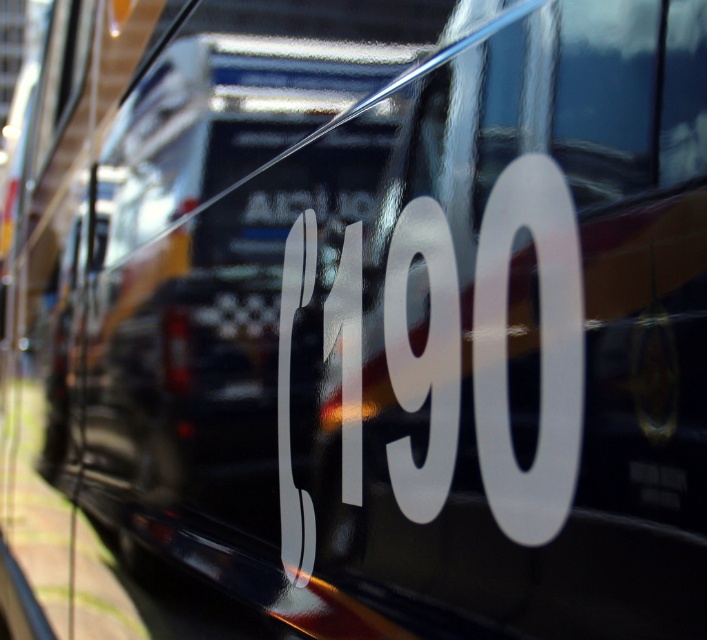
Question: Is glossy black number at center to the right of white glossy number at center from the viewer's perspective?

Choices:
 (A) no
 (B) yes

Answer: (A)

Question: Which point is farther to the camera?

Choices:
 (A) (271, 272)
 (B) (438, 365)

Answer: (A)

Question: Which object is closer to the camera taking this photo?

Choices:
 (A) white glossy number at center
 (B) glossy black number at center

Answer: (A)

Question: Can you confirm if glossy black number at center is positioned to the left of white glossy number at center?

Choices:
 (A) yes
 (B) no

Answer: (A)

Question: Is glossy black number at center further to camera compared to white glossy number at center?

Choices:
 (A) yes
 (B) no

Answer: (A)